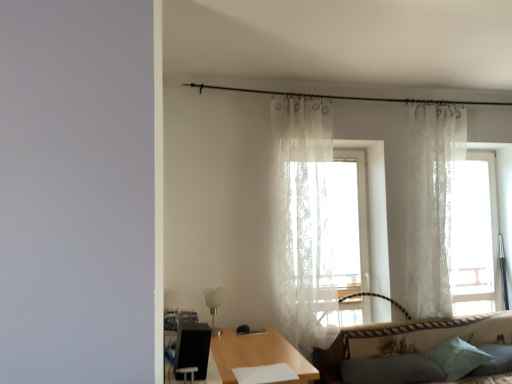
Find the location of a particular element. vacant space underneath white lace curtain at upper right, which ranks as the 1th curtain in right-to-left order (from a real-world perspective) is located at coordinates (445, 321).